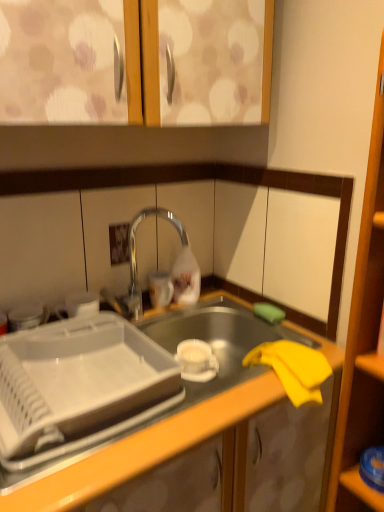
Question: Can you confirm if polished chrome tap at center is thinner than white plastic tray at center?

Choices:
 (A) no
 (B) yes

Answer: (B)

Question: Is polished chrome tap at center positioned behind white plastic tray at center?

Choices:
 (A) yes
 (B) no

Answer: (A)

Question: From the image's perspective, would you say polished chrome tap at center is shown under white plastic tray at center?

Choices:
 (A) yes
 (B) no

Answer: (B)

Question: Considering the relative sizes of polished chrome tap at center and white plastic tray at center in the image provided, is polished chrome tap at center taller than white plastic tray at center?

Choices:
 (A) no
 (B) yes

Answer: (B)

Question: From a real-world perspective, is polished chrome tap at center beneath white plastic tray at center?

Choices:
 (A) no
 (B) yes

Answer: (A)

Question: Looking at the image, does transparent plastic shelf at lower right seem bigger or smaller compared to yellow fabric at lower right?

Choices:
 (A) small
 (B) big

Answer: (A)

Question: Is point (377, 502) closer or farther from the camera than point (100, 494)?

Choices:
 (A) farther
 (B) closer

Answer: (A)

Question: From the image's perspective, is transparent plastic shelf at lower right located above or below yellow fabric at lower right?

Choices:
 (A) above
 (B) below

Answer: (A)

Question: From a real-world perspective, relative to yellow fabric at lower right, is transparent plastic shelf at lower right vertically above or below?

Choices:
 (A) above
 (B) below

Answer: (A)

Question: In terms of height, does yellow fabric at lower right look taller or shorter compared to transparent plastic shelf at lower right?

Choices:
 (A) tall
 (B) short

Answer: (A)

Question: Considering their positions, is yellow fabric at lower right located in front of or behind transparent plastic shelf at lower right?

Choices:
 (A) behind
 (B) front

Answer: (B)

Question: Looking at their shapes, would you say yellow fabric at lower right is wider or thinner than transparent plastic shelf at lower right?

Choices:
 (A) wide
 (B) thin

Answer: (A)

Question: From the image's perspective, is yellow fabric at lower right above or below transparent plastic shelf at lower right?

Choices:
 (A) above
 (B) below

Answer: (B)

Question: In terms of width, does transparent plastic shelf at lower right look wider or thinner when compared to polished chrome tap at center?

Choices:
 (A) thin
 (B) wide

Answer: (B)

Question: From a real-world perspective, relative to polished chrome tap at center, is transparent plastic shelf at lower right vertically above or below?

Choices:
 (A) above
 (B) below

Answer: (B)